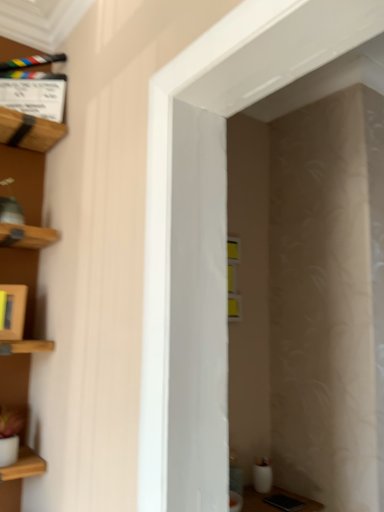
Question: Considering their positions, is wooden frame at left located in front of or behind white glossy door at center?

Choices:
 (A) front
 (B) behind

Answer: (B)

Question: In terms of height, does wooden frame at left look taller or shorter compared to white glossy door at center?

Choices:
 (A) tall
 (B) short

Answer: (B)

Question: Which of these objects is positioned farthest from the white glossy door at center?

Choices:
 (A) wooden clapperboard at upper left
 (B) wooden frame at left

Answer: (A)

Question: Estimate the real-world distances between objects in this image. Which object is farther from the wooden clapperboard at upper left?

Choices:
 (A) wooden frame at left
 (B) white glossy door at center

Answer: (B)